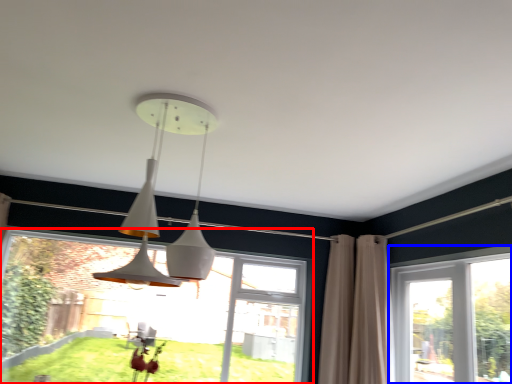
Question: Which object appears farthest to the camera in this image, window (highlighted by a red box) or window (highlighted by a blue box)?

Choices:
 (A) window
 (B) window

Answer: (A)